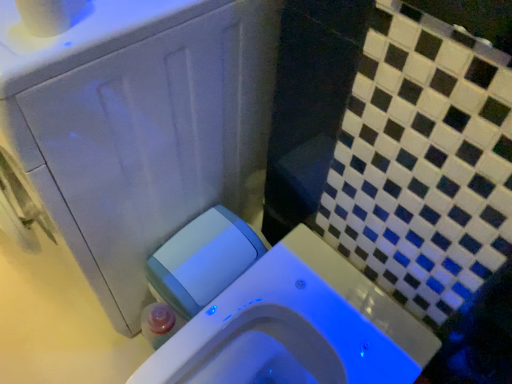
Question: Is white plastic water tank at lower left not within white glossy toilet at center?

Choices:
 (A) no
 (B) yes

Answer: (B)

Question: Is white plastic water tank at lower left oriented away from white glossy toilet at center?

Choices:
 (A) yes
 (B) no

Answer: (B)

Question: From the image's perspective, is white plastic water tank at lower left located beneath white glossy toilet at center?

Choices:
 (A) yes
 (B) no

Answer: (B)

Question: Is white plastic water tank at lower left smaller than white glossy toilet at center?

Choices:
 (A) no
 (B) yes

Answer: (B)

Question: Does white plastic water tank at lower left touch white glossy toilet at center?

Choices:
 (A) yes
 (B) no

Answer: (B)

Question: Is point (419, 329) closer or farther from the camera than point (201, 243)?

Choices:
 (A) closer
 (B) farther

Answer: (A)

Question: Considering the positions of white glossy toilet at center and white plastic water tank at lower left in the image, is white glossy toilet at center wider or thinner than white plastic water tank at lower left?

Choices:
 (A) wide
 (B) thin

Answer: (A)

Question: From their relative heights in the image, would you say white glossy toilet at center is taller or shorter than white plastic water tank at lower left?

Choices:
 (A) tall
 (B) short

Answer: (A)

Question: Looking at the image, does white glossy toilet at center seem bigger or smaller compared to white plastic water tank at lower left?

Choices:
 (A) small
 (B) big

Answer: (B)

Question: Considering the positions of white matte toilet paper at upper left and white plastic water tank at lower left in the image, is white matte toilet paper at upper left taller or shorter than white plastic water tank at lower left?

Choices:
 (A) tall
 (B) short

Answer: (B)

Question: Looking at the image, does white matte toilet paper at upper left seem bigger or smaller compared to white plastic water tank at lower left?

Choices:
 (A) big
 (B) small

Answer: (B)

Question: From the image's perspective, relative to white plastic water tank at lower left, is white matte toilet paper at upper left above or below?

Choices:
 (A) above
 (B) below

Answer: (A)

Question: Considering their positions, is white matte toilet paper at upper left located in front of or behind white plastic water tank at lower left?

Choices:
 (A) front
 (B) behind

Answer: (A)

Question: From a real-world perspective, is white matte toilet paper at upper left above or below white glossy toilet at center?

Choices:
 (A) above
 (B) below

Answer: (A)

Question: Would you say white matte toilet paper at upper left is to the left or to the right of white glossy toilet at center in the picture?

Choices:
 (A) right
 (B) left

Answer: (B)